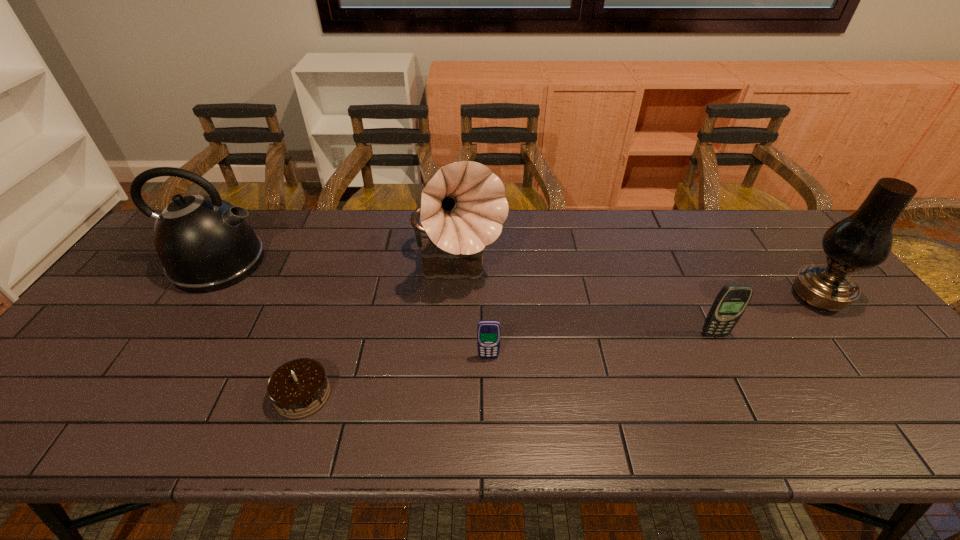
This screenshot has height=540, width=960. In order to click on vacant space located on the front of the rightmost object in this screenshot , I will do (911, 418).

This screenshot has height=540, width=960. Identify the location of vacant space situated 0.330m on the spout of the kettle. (378, 263).

Where is `vacant space located 0.070m on the screen of the fourth tallest object`? vacant space located 0.070m on the screen of the fourth tallest object is located at coordinates (727, 360).

The image size is (960, 540). Identify the location of free spot located 0.180m on the front-facing side of the shorter cellular telephone. (490, 429).

Find the location of a particular element. This screenshot has width=960, height=540. vacant space located on the back of the fifth object from right to left is located at coordinates (342, 280).

At what (x,y) coordinates should I click in order to perform the action: click on record player situated at the far edge. Please return your answer as a coordinate pair (x, y). Image resolution: width=960 pixels, height=540 pixels. Looking at the image, I should click on (463, 207).

This screenshot has width=960, height=540. In order to click on kettle situated at the far edge in this screenshot , I will do `click(206, 244)`.

The width and height of the screenshot is (960, 540). Identify the location of object located in the near edge section of the desktop. (299, 388).

The width and height of the screenshot is (960, 540). In order to click on object present at the left edge in this screenshot , I will do `click(206, 244)`.

Where is `object that is at the right edge`? object that is at the right edge is located at coordinates (863, 240).